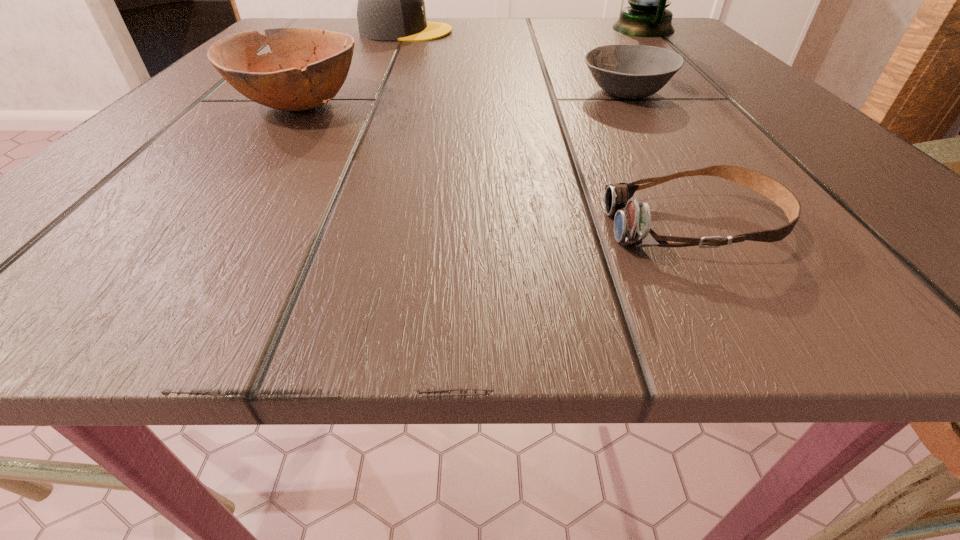
Locate an element on the screen. The width and height of the screenshot is (960, 540). free space between the lantern and the cap is located at coordinates (524, 30).

Locate an element on the screen. This screenshot has width=960, height=540. object that ranks as the closest to the taller bowl is located at coordinates (391, 6).

Where is `object identified as the second closest to the left bowl`? This screenshot has height=540, width=960. object identified as the second closest to the left bowl is located at coordinates (626, 71).

Identify the location of free space that satisfies the following two spatial constraints: 1. on the back side of the shorter bowl; 2. on the front-facing side of the cap. (587, 32).

Find the location of a particular element. vacant space that satisfies the following two spatial constraints: 1. on the front-facing side of the shorter bowl; 2. on the left side of the cap is located at coordinates (379, 92).

Locate an element on the screen. The image size is (960, 540). free space that satisfies the following two spatial constraints: 1. on the front-facing side of the cap; 2. on the back side of the shorter bowl is located at coordinates (379, 92).